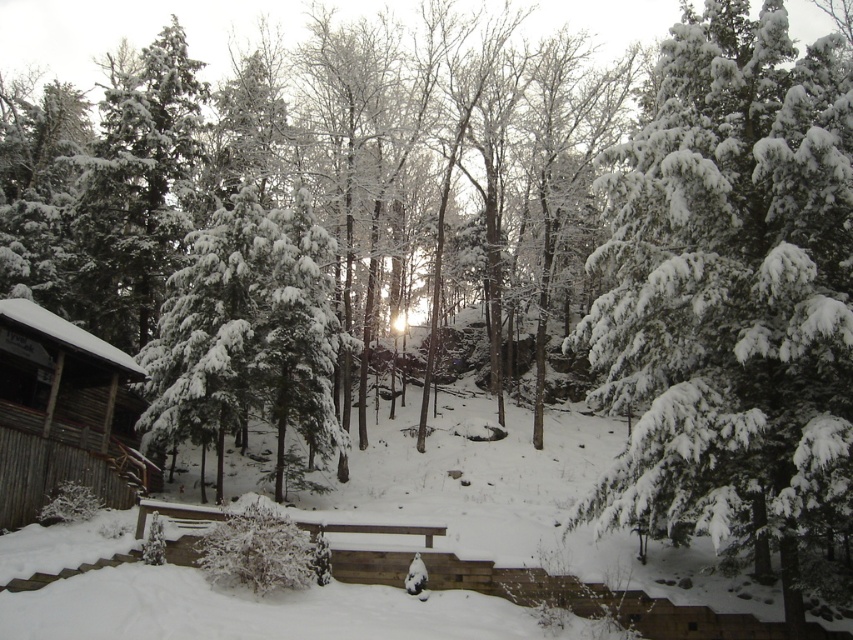
Question: Can you confirm if snow-covered evergreen at center is positioned below wooden cabin at left?

Choices:
 (A) no
 (B) yes

Answer: (A)

Question: Does snow-covered evergreen at center appear over wooden cabin at left?

Choices:
 (A) yes
 (B) no

Answer: (A)

Question: Which object appears farthest from the camera in this image?

Choices:
 (A) snow-covered evergreen at center
 (B) wooden cabin at left

Answer: (B)

Question: Is snow-covered evergreen at center above wooden cabin at left?

Choices:
 (A) no
 (B) yes

Answer: (B)